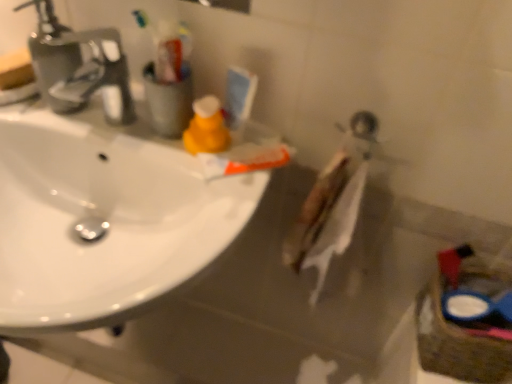
Question: Considering the positions of blue plastic basket at lower right and white glossy sink at upper left in the image, is blue plastic basket at lower right bigger or smaller than white glossy sink at upper left?

Choices:
 (A) small
 (B) big

Answer: (A)

Question: Based on their positions, is blue plastic basket at lower right located to the left or right of white glossy sink at upper left?

Choices:
 (A) right
 (B) left

Answer: (A)

Question: Which of these objects is positioned farthest from the white glossy sink at upper left?

Choices:
 (A) matte orange spray bottle at upper center
 (B) blue plastic basket at lower right
 (C) satin nickel faucet at upper left
 (D) white matte toothpaste at center

Answer: (B)

Question: Which of these objects is positioned farthest from the white glossy sink at upper left?

Choices:
 (A) white matte toothpaste at center
 (B) matte orange spray bottle at upper center
 (C) blue plastic basket at lower right
 (D) satin nickel faucet at upper left

Answer: (C)